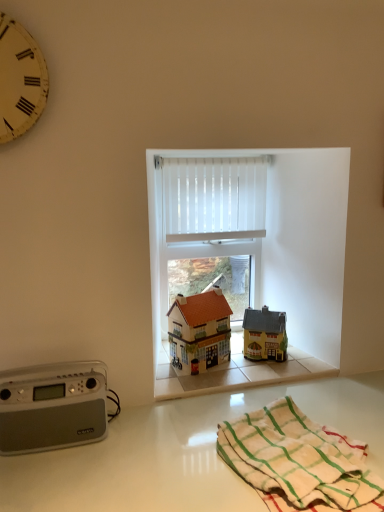
Locate an element on the screen. This screenshot has width=384, height=512. free spot to the right of matte orange roofed house at center, the 2th toy in the right-to-left sequence is located at coordinates (250, 372).